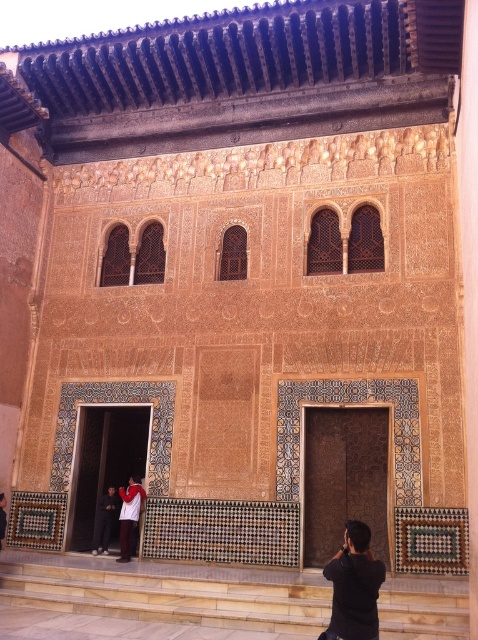
Question: Based on their relative distances, which object is farther from the black matte shirt at lower right?

Choices:
 (A) light beige stone stairs at lower center
 (B) white cotton shirt at center

Answer: (B)

Question: Which point is farther to the camera?

Choices:
 (A) dark gray fabric pants at lower left
 (B) white cotton shirt at center
 (C) light beige stone stairs at lower center

Answer: (A)

Question: Is light beige stone stairs at lower center bigger than dark gray fabric pants at lower left?

Choices:
 (A) yes
 (B) no

Answer: (A)

Question: Which object is the farthest from the black matte shirt at lower right?

Choices:
 (A) white cotton shirt at center
 (B) dark gray fabric pants at lower left
 (C) light beige stone stairs at lower center

Answer: (B)

Question: In this image, where is black matte shirt at lower right located relative to white cotton shirt at center?

Choices:
 (A) above
 (B) below

Answer: (A)

Question: Is black matte shirt at lower right closer to the viewer compared to white cotton shirt at center?

Choices:
 (A) yes
 (B) no

Answer: (A)